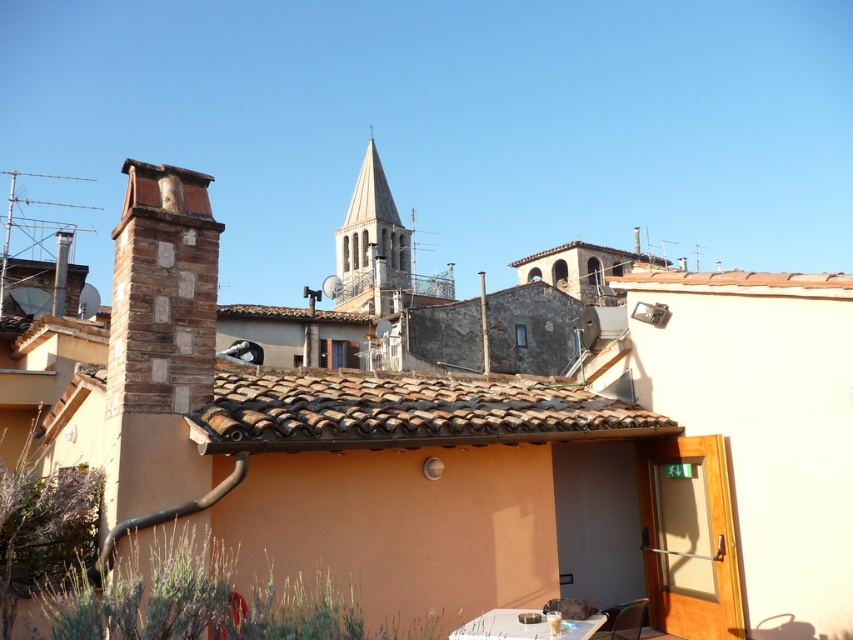
You are standing on the rooftop and want to place a potted plant exactly at the point marked by the coordinates point [404,410]. Is this location on the brown clay tiles at center?

Yes, the point [404,410] corresponds to the brown clay tiles at center, so placing the potted plant there would be appropriate.

You are standing on the rooftop and want to place a potted plant between the brown clay tiles at center and the brown tile roof at upper center. Based on their positions, which direction should you move the plant to place it between them?

The brown clay tiles at center is to the left of brown tile roof at upper center, so you should move the plant to the right to place it between them.